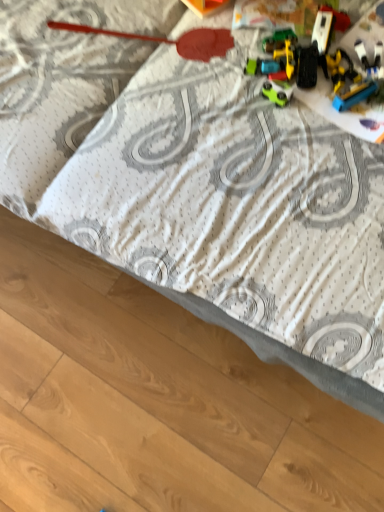
Question: Could you tell me if yellow plastic toy truck at upper right, which is counted as the 4th toy, starting from the left, is turned towards metallic red spatula at upper center, positioned as the 1th toy in left-to-right order?

Choices:
 (A) no
 (B) yes

Answer: (A)

Question: Considering the relative sizes of yellow plastic toy truck at upper right, which is the first toy in right-to-left order, and metallic red spatula at upper center, the 4th toy when ordered from right to left, in the image provided, is yellow plastic toy truck at upper right, which is the first toy in right-to-left order, wider than metallic red spatula at upper center, the 4th toy when ordered from right to left,?

Choices:
 (A) yes
 (B) no

Answer: (A)

Question: Is the depth of yellow plastic toy truck at upper right, which is the first toy in right-to-left order, greater than that of metallic red spatula at upper center, the 4th toy when ordered from right to left?

Choices:
 (A) no
 (B) yes

Answer: (A)

Question: Is yellow plastic toy truck at upper right, which is the first toy in right-to-left order, not close to metallic red spatula at upper center, the 4th toy when ordered from right to left?

Choices:
 (A) yes
 (B) no

Answer: (B)

Question: Is yellow plastic toy truck at upper right, which is the first toy in right-to-left order, next to metallic red spatula at upper center, positioned as the 1th toy in left-to-right order?

Choices:
 (A) no
 (B) yes

Answer: (A)

Question: Considering their positions, is green matte car at center, placed as the third toy when sorted from right to left, located in front of or behind multicolored plastic toy cars at upper right, positioned as the 3th toy in left-to-right order?

Choices:
 (A) front
 (B) behind

Answer: (B)

Question: In terms of size, does green matte car at center, the second toy positioned from the left, appear bigger or smaller than multicolored plastic toy cars at upper right, positioned as the 3th toy in left-to-right order?

Choices:
 (A) big
 (B) small

Answer: (B)

Question: Is green matte car at center, the second toy positioned from the left, wider or thinner than multicolored plastic toy cars at upper right, acting as the second toy starting from the right?

Choices:
 (A) thin
 (B) wide

Answer: (A)

Question: Would you say green matte car at center, placed as the third toy when sorted from right to left, is to the left or to the right of multicolored plastic toy cars at upper right, positioned as the 3th toy in left-to-right order, in the picture?

Choices:
 (A) right
 (B) left

Answer: (B)

Question: In the image, is metallic red spatula at upper center, the 4th toy when ordered from right to left, on the left side or the right side of yellow plastic toy truck at upper right, which is the first toy in right-to-left order?

Choices:
 (A) right
 (B) left

Answer: (B)

Question: Based on their sizes in the image, would you say metallic red spatula at upper center, positioned as the 1th toy in left-to-right order, is bigger or smaller than yellow plastic toy truck at upper right, which is the first toy in right-to-left order?

Choices:
 (A) big
 (B) small

Answer: (A)

Question: From a real-world perspective, is metallic red spatula at upper center, positioned as the 1th toy in left-to-right order, physically located above or below yellow plastic toy truck at upper right, which is the first toy in right-to-left order?

Choices:
 (A) below
 (B) above

Answer: (A)

Question: Would you say metallic red spatula at upper center, the 4th toy when ordered from right to left, is inside or outside yellow plastic toy truck at upper right, which is the first toy in right-to-left order?

Choices:
 (A) inside
 (B) outside

Answer: (B)

Question: Is yellow plastic toy truck at upper right, which is the first toy in right-to-left order, inside the boundaries of green matte car at center, placed as the third toy when sorted from right to left, or outside?

Choices:
 (A) outside
 (B) inside

Answer: (A)

Question: Is point (372, 91) positioned closer to the camera than point (284, 95)?

Choices:
 (A) farther
 (B) closer

Answer: (B)